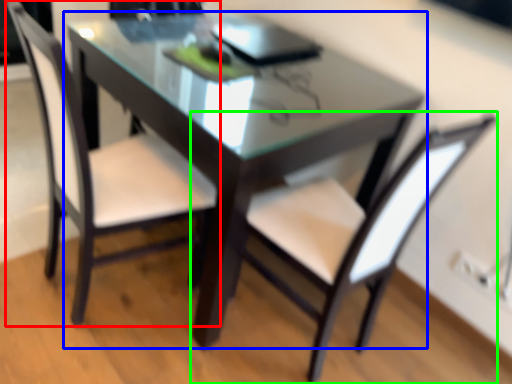
Question: Which is farther away from chair (highlighted by a red box)? table (highlighted by a blue box) or chair (highlighted by a green box)?

Choices:
 (A) table
 (B) chair

Answer: (B)